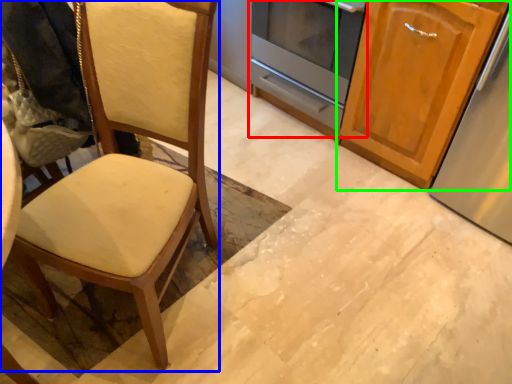
Question: Which is nearer to the oven (highlighted by a red box)? chair (highlighted by a blue box) or cabinetry (highlighted by a green box).

Choices:
 (A) chair
 (B) cabinetry

Answer: (B)